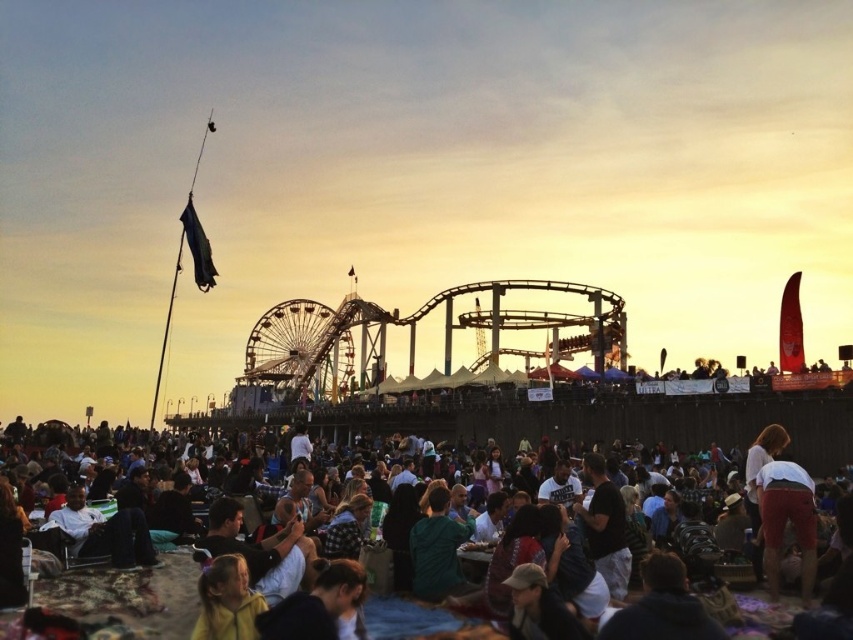
You are standing at the beach and want to take a photo of the metallic roller coaster at center without any people in the frame. Given the dark clothing crowd at lower center is below the roller coaster, can you position yourself in a way to avoid capturing the crowd?

The dark clothing crowd at lower center is below the metallic roller coaster at center, so if you position yourself higher or angle your camera upwards, you can capture the roller coaster without the crowd obstructing the view.

You are a photographer planning to capture the sunset with both the dark clothing crowd at lower center and the metallic ferris wheel at center in your shot. Which object should you focus on first to ensure both are in frame?

Since the dark clothing crowd at lower center is larger in size compared to the metallic ferris wheel at center, you should focus on the dark clothing crowd at lower center first to ensure both fit within the frame.

You are a photographer planning to take a wide shot of the beachside amusement park scene. You want to ensure both the dark clothing crowd at lower center and the metallic roller coaster at center are clearly visible in the frame. Based on their sizes, which object should you prioritize positioning closer to the camera to maintain detail?

The dark clothing crowd at lower center is smaller than the metallic roller coaster at center. To maintain detail for both, prioritize positioning the dark clothing crowd at lower center closer to the camera since it is smaller and might need better focus to be clearly visible.